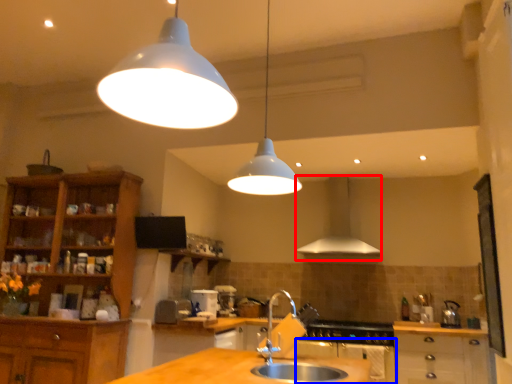
Question: Which object appears farthest to the camera in this image, exhaust hood (highlighted by a red box) or oven (highlighted by a blue box)?

Choices:
 (A) exhaust hood
 (B) oven

Answer: (A)